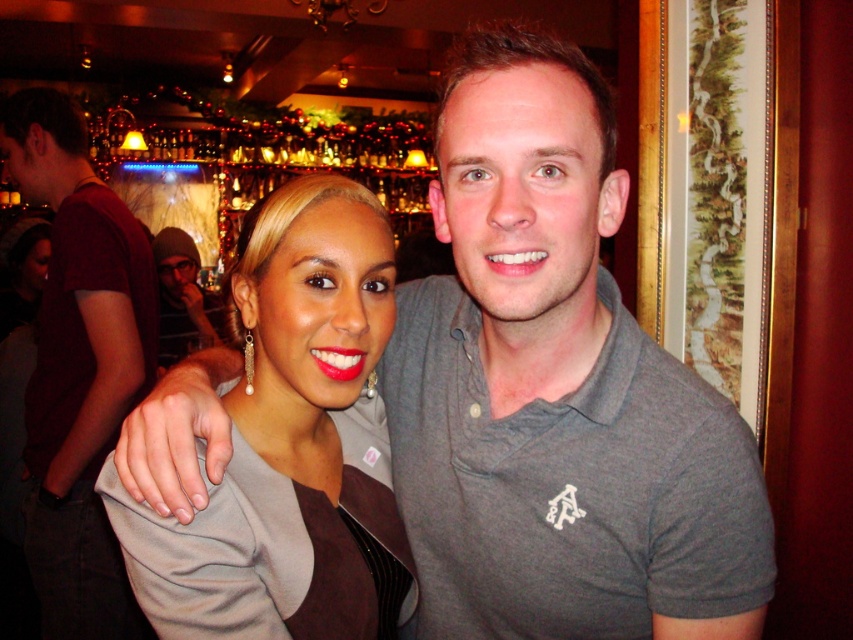
You are trying to decide which piece of clothing to wear for a casual evening out. You have the matte gray blazer at center and the dark gray hoodie at upper left. Based on their sizes, which one might be more suitable for layering under a coat?

The dark gray hoodie at upper left is taller than the matte gray blazer at center, so it might be more suitable for layering under a coat as it has a longer length which can provide better coverage and comfort when layered.